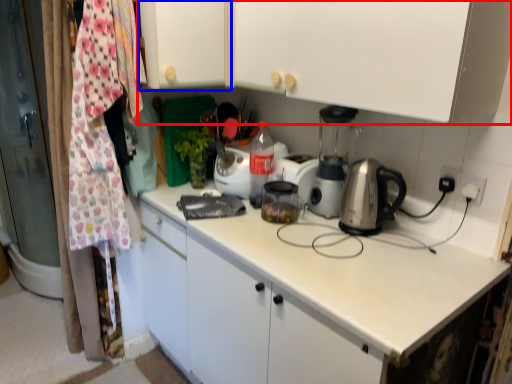
Question: Which of the following is the farthest to the observer, cabinetry (highlighted by a red box) or cabinetry (highlighted by a blue box)?

Choices:
 (A) cabinetry
 (B) cabinetry

Answer: (B)